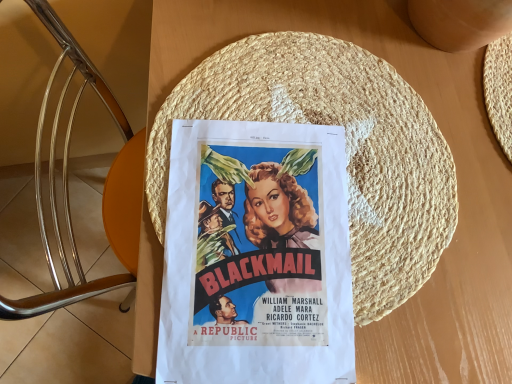
Locate an element on the screen. This screenshot has height=384, width=512. vacant space to the right of matte paper poster at center is located at coordinates (426, 273).